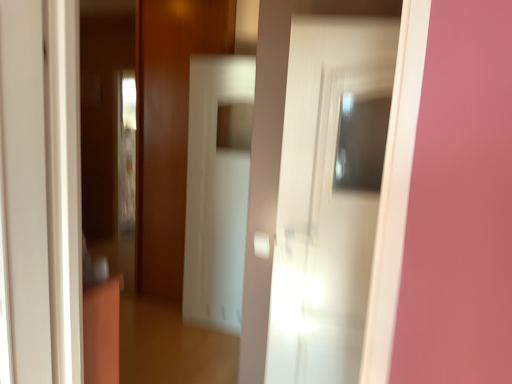
Question: Can you confirm if white glossy screen door at center is wider than white glossy door at left, the 1th door viewed from the front?

Choices:
 (A) no
 (B) yes

Answer: (A)

Question: Is white glossy screen door at center smaller than white glossy door at left, the second door viewed from the right?

Choices:
 (A) no
 (B) yes

Answer: (A)

Question: From the image's perspective, does white glossy screen door at center appear lower than white glossy door at left, which is the 1th door from left to right?

Choices:
 (A) no
 (B) yes

Answer: (A)

Question: Is white glossy screen door at center positioned beyond the bounds of white glossy door at left, the 1th door viewed from the front?

Choices:
 (A) yes
 (B) no

Answer: (A)

Question: Is white glossy screen door at center thinner than white glossy door at left, which is the 1th door from left to right?

Choices:
 (A) no
 (B) yes

Answer: (B)

Question: Is white glossy screen door at center aimed at white glossy door at left, which is the 1th door from left to right?

Choices:
 (A) yes
 (B) no

Answer: (A)

Question: From the image's perspective, is white glossy door at center, placed as the 2th door when sorted from front to back, located above white glossy door at left, the second door viewed from the right?

Choices:
 (A) no
 (B) yes

Answer: (A)

Question: Is white glossy door at center, the 1th door from the back, with white glossy door at left, the 1th door viewed from the front?

Choices:
 (A) no
 (B) yes

Answer: (A)

Question: Is white glossy door at center, acting as the second door starting from the left, located outside white glossy door at left, the second door viewed from the right?

Choices:
 (A) yes
 (B) no

Answer: (A)

Question: Are white glossy door at center, placed as the 2th door when sorted from front to back, and white glossy door at left, which is counted as the second door, starting from the back, located far from each other?

Choices:
 (A) no
 (B) yes

Answer: (B)

Question: Is white glossy door at center, the 1th door from the back, closer to camera compared to white glossy door at left, the second door viewed from the right?

Choices:
 (A) yes
 (B) no

Answer: (B)

Question: From a real-world perspective, is white glossy door at center, placed as the 2th door when sorted from front to back, on white glossy door at left, the second door viewed from the right?

Choices:
 (A) yes
 (B) no

Answer: (B)

Question: From a real-world perspective, is white glossy door at left, the second door viewed from the right, positioned under white glossy door at center, the 1th door from the back, based on gravity?

Choices:
 (A) no
 (B) yes

Answer: (A)